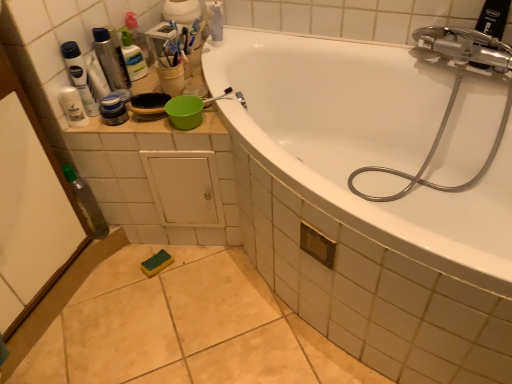
Question: Considering the positions of matte black jar at upper left, which is the first toiletry in bottom-to-top order, and transparent plastic screen door at left in the image, is matte black jar at upper left, which is the first toiletry in bottom-to-top order, taller or shorter than transparent plastic screen door at left?

Choices:
 (A) short
 (B) tall

Answer: (A)

Question: From the image's perspective, relative to transparent plastic screen door at left, is matte black jar at upper left, acting as the 3th toiletry starting from the top, above or below?

Choices:
 (A) above
 (B) below

Answer: (A)

Question: Estimate the real-world distances between objects in this image. Which object is closer to the transparent plastic screen door at left?

Choices:
 (A) white glossy mouthwash at upper left
 (B) white glossy bathtub at upper center
 (C) matte black jar at upper left, which is the first toiletry in bottom-to-top order
 (D) silver metallic hose at upper right
 (E) translucent plastic container at upper left, which ranks as the 1th toiletry in top-to-bottom order

Answer: (A)

Question: Based on their relative distances, which object is nearer to the transparent plastic screen door at left?

Choices:
 (A) white glossy mouthwash at upper left
 (B) transparent plastic bottle at left
 (C) silver metallic hose at upper right
 (D) translucent plastic container at upper left, which ranks as the 1th toiletry in top-to-bottom order
 (E) matte black jar at upper left, acting as the 3th toiletry starting from the top

Answer: (B)